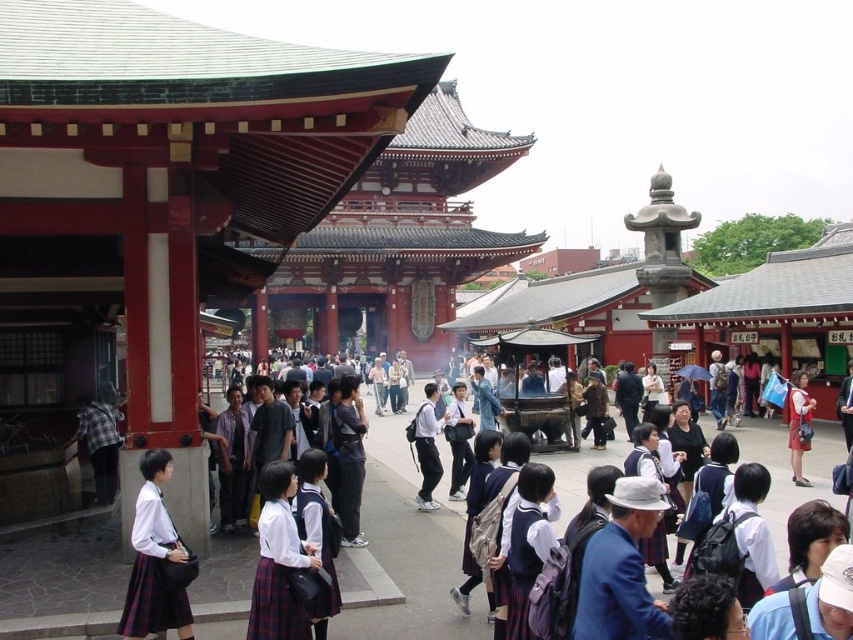
In the scene shown: You are a photographer standing in front of the temple gate. You want to take a photo of the two groups of people wearing white clothing in the scene. The first group is wearing the white school uniform at center, and the second group is wearing the white cotton shirt at center. Which group should you focus on if you want to capture the taller clothing items in your shot?

The white cotton shirt at center is taller than the white school uniform at center, so you should focus on the group wearing the white cotton shirt at center to capture the taller clothing items.